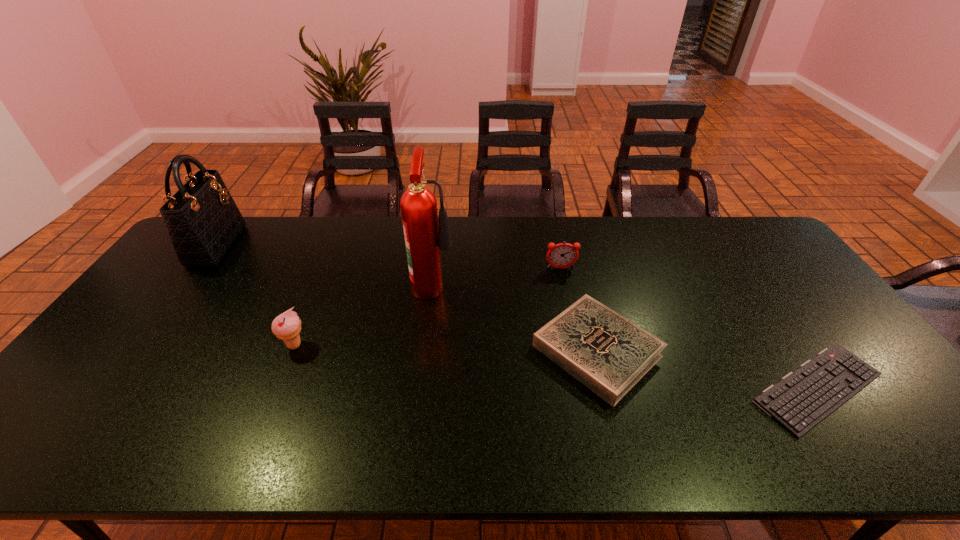
Image resolution: width=960 pixels, height=540 pixels. In order to click on object positioned at the far left corner in this screenshot , I will do `click(203, 222)`.

This screenshot has width=960, height=540. I want to click on object located in the near right corner section of the desktop, so click(803, 398).

Where is `free space at the far edge of the desktop`? This screenshot has width=960, height=540. free space at the far edge of the desktop is located at coordinates (479, 239).

I want to click on free space at the near edge of the desktop, so click(x=486, y=457).

Where is `vacant space at the left edge`? Image resolution: width=960 pixels, height=540 pixels. vacant space at the left edge is located at coordinates (176, 280).

At what (x,y) coordinates should I click in order to perform the action: click on blank space at the right edge. Please return your answer as a coordinate pair (x, y). The image size is (960, 540). Looking at the image, I should click on (873, 388).

Identify the location of free region at the near right corner of the desktop. Image resolution: width=960 pixels, height=540 pixels. (917, 451).

Where is `free space between the hardback book and the computer keyboard`? free space between the hardback book and the computer keyboard is located at coordinates (708, 369).

Where is `empty location between the fourth tallest object and the computer keyboard`? The image size is (960, 540). empty location between the fourth tallest object and the computer keyboard is located at coordinates (689, 328).

I want to click on unoccupied position between the fire extinguisher and the fifth tallest object, so click(x=516, y=317).